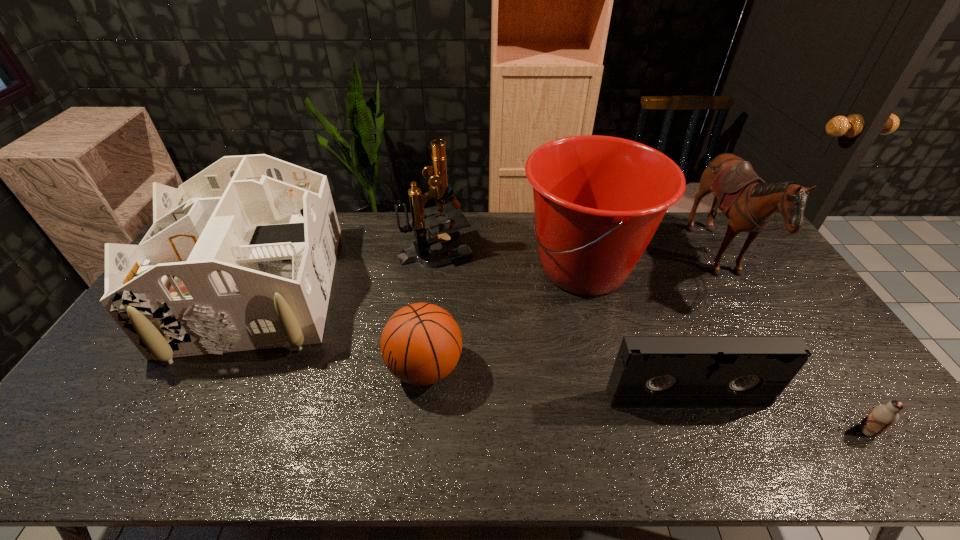
You are a GUI agent. You are given a task and a screenshot of the screen. Output one action in this format:
    pyautogui.click(x=<x>, y=<y>)
    Task: Click on the free space located on the back of the saddle
    The width and height of the screenshot is (960, 540).
    Given the screenshot: What is the action you would take?
    pyautogui.click(x=644, y=261)

Locate an element on the screen. The height and width of the screenshot is (540, 960). free region located 0.350m on the back of the saddle is located at coordinates [598, 261].

The height and width of the screenshot is (540, 960). Find the location of `vacant point located 0.220m at the eyepiece of the microscope`. vacant point located 0.220m at the eyepiece of the microscope is located at coordinates (535, 248).

Where is `blank area located with the handle attached to the rim of the bucket`? blank area located with the handle attached to the rim of the bucket is located at coordinates (399, 268).

You are a GUI agent. You are given a task and a screenshot of the screen. Output one action in this format:
    pyautogui.click(x=<x>, y=<y>)
    Task: Click on the free space located 0.320m with the handle attached to the rim of the bucket
    The height and width of the screenshot is (540, 960).
    Given the screenshot: What is the action you would take?
    pyautogui.click(x=423, y=268)

This screenshot has height=540, width=960. In order to click on vacant space located with the handle attached to the rim of the bucket in this screenshot , I will do (420, 268).

This screenshot has height=540, width=960. In order to click on free space located on the front of the leftmost object in this screenshot , I will do `click(186, 423)`.

Locate an element on the screen. This screenshot has height=540, width=960. vacant space located 0.090m on the side of the videotape with visible spindles is located at coordinates (703, 442).

This screenshot has width=960, height=540. What are the coordinates of `free space located 0.280m on the right of the basketball` in the screenshot? It's located at (566, 368).

Where is `vacant space located 0.130m on the back of the shortest object`? This screenshot has width=960, height=540. vacant space located 0.130m on the back of the shortest object is located at coordinates (830, 377).